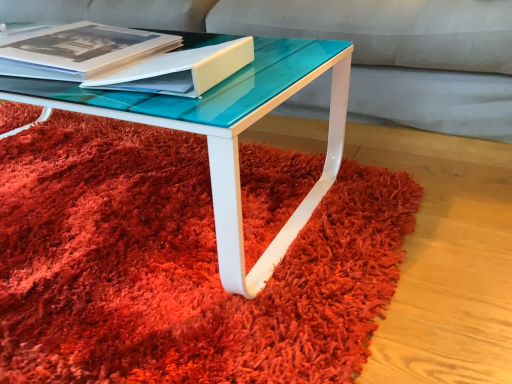
Question: Should I look upward or downward to see matte white book at center?

Choices:
 (A) up
 (B) down

Answer: (A)

Question: Is matte white book at center positioned before shaggy red carpet at center?

Choices:
 (A) no
 (B) yes

Answer: (A)

Question: Considering the relative sizes of matte white book at center and shaggy red carpet at center in the image provided, is matte white book at center smaller than shaggy red carpet at center?

Choices:
 (A) yes
 (B) no

Answer: (A)

Question: Is matte white book at center bigger than shaggy red carpet at center?

Choices:
 (A) yes
 (B) no

Answer: (B)

Question: Considering the relative sizes of matte white book at center and shaggy red carpet at center in the image provided, is matte white book at center thinner than shaggy red carpet at center?

Choices:
 (A) yes
 (B) no

Answer: (A)

Question: From the image's perspective, is matte white book at center located above shaggy red carpet at center?

Choices:
 (A) yes
 (B) no

Answer: (A)

Question: Are matte white book at center and shaggy red carpet at center located far from each other?

Choices:
 (A) yes
 (B) no

Answer: (B)

Question: Is matte black book at upper left positioned in front of matte white book at center?

Choices:
 (A) yes
 (B) no

Answer: (B)

Question: Is matte black book at upper left positioned beyond the bounds of matte white book at center?

Choices:
 (A) yes
 (B) no

Answer: (A)

Question: From the image's perspective, is matte black book at upper left located beneath matte white book at center?

Choices:
 (A) no
 (B) yes

Answer: (A)

Question: Considering the relative sizes of matte black book at upper left and matte white book at center in the image provided, is matte black book at upper left taller than matte white book at center?

Choices:
 (A) no
 (B) yes

Answer: (B)

Question: Considering the relative positions of matte black book at upper left and matte white book at center in the image provided, is matte black book at upper left to the right of matte white book at center from the viewer's perspective?

Choices:
 (A) no
 (B) yes

Answer: (A)

Question: Is matte white book at center located within matte black book at upper left?

Choices:
 (A) yes
 (B) no

Answer: (B)

Question: Considering the relative positions of shaggy red carpet at center and matte black book at upper left in the image provided, is shaggy red carpet at center to the left of matte black book at upper left from the viewer's perspective?

Choices:
 (A) yes
 (B) no

Answer: (A)